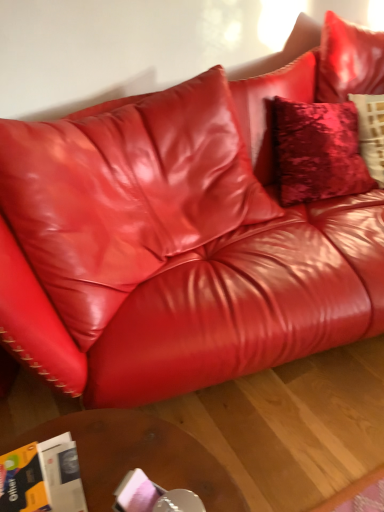
Question: From a real-world perspective, is orange glossy magazine at lower left located higher than brown wooden table at lower center?

Choices:
 (A) yes
 (B) no

Answer: (A)

Question: Is orange glossy magazine at lower left positioned before brown wooden table at lower center?

Choices:
 (A) no
 (B) yes

Answer: (B)

Question: Is orange glossy magazine at lower left aimed at brown wooden table at lower center?

Choices:
 (A) no
 (B) yes

Answer: (A)

Question: Does orange glossy magazine at lower left appear on the left side of brown wooden table at lower center?

Choices:
 (A) yes
 (B) no

Answer: (A)

Question: Considering the relative sizes of orange glossy magazine at lower left and brown wooden table at lower center in the image provided, is orange glossy magazine at lower left wider than brown wooden table at lower center?

Choices:
 (A) yes
 (B) no

Answer: (B)

Question: Is orange glossy magazine at lower left positioned far away from brown wooden table at lower center?

Choices:
 (A) no
 (B) yes

Answer: (A)

Question: Is brown wooden table at lower center directly adjacent to orange glossy magazine at lower left?

Choices:
 (A) yes
 (B) no

Answer: (B)

Question: Is brown wooden table at lower center aimed at orange glossy magazine at lower left?

Choices:
 (A) no
 (B) yes

Answer: (A)

Question: Considering the relative sizes of brown wooden table at lower center and orange glossy magazine at lower left in the image provided, is brown wooden table at lower center smaller than orange glossy magazine at lower left?

Choices:
 (A) no
 (B) yes

Answer: (A)

Question: Can you confirm if brown wooden table at lower center is positioned to the right of orange glossy magazine at lower left?

Choices:
 (A) yes
 (B) no

Answer: (A)

Question: Can you confirm if brown wooden table at lower center is taller than orange glossy magazine at lower left?

Choices:
 (A) yes
 (B) no

Answer: (A)

Question: Is brown wooden table at lower center located outside orange glossy magazine at lower left?

Choices:
 (A) no
 (B) yes

Answer: (B)

Question: From the image's perspective, is orange glossy magazine at lower left above or below brown wooden table at lower center?

Choices:
 (A) below
 (B) above

Answer: (B)